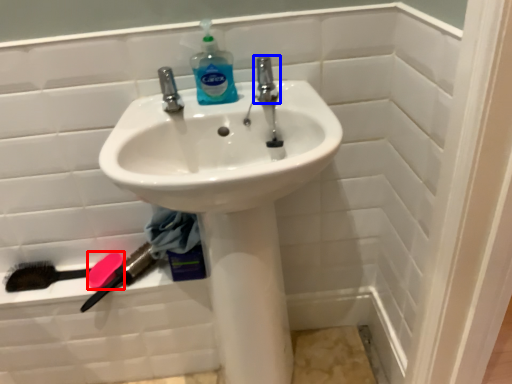
Question: Among these objects, which one is farthest to the camera, soap (highlighted by a red box) or tap (highlighted by a blue box)?

Choices:
 (A) soap
 (B) tap

Answer: (A)